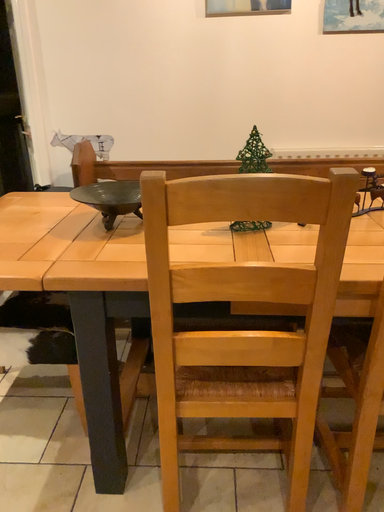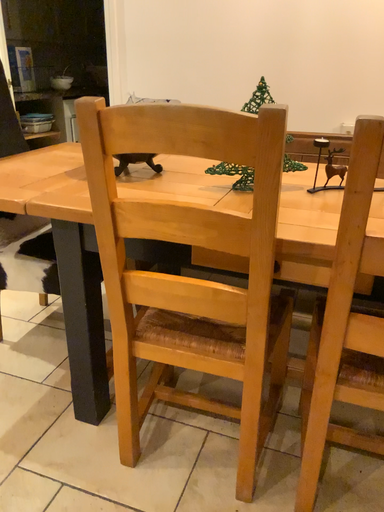
Question: How did the camera likely rotate when shooting the video?

Choices:
 (A) rotated left
 (B) rotated right

Answer: (A)